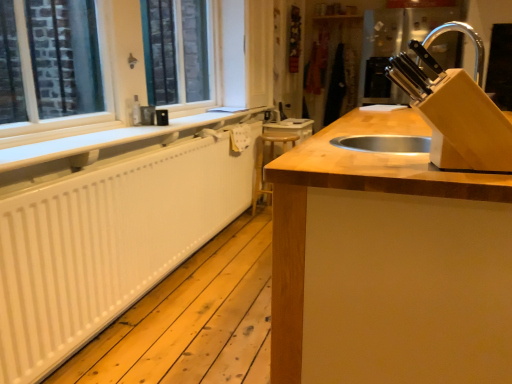
Identify the location of free point below white matte radiator at left (from a real-world perspective). The height and width of the screenshot is (384, 512). (168, 280).